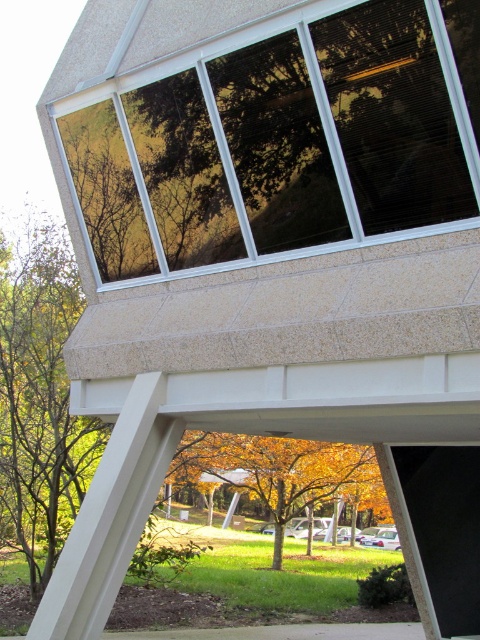
Does clear glass window at upper center have a greater height compared to golden leafy tree at center?

No, clear glass window at upper center is not taller than golden leafy tree at center.

This screenshot has height=640, width=480. What are the coordinates of `clear glass window at upper center` in the screenshot? It's located at (272, 140).

What are the coordinates of `clear glass window at upper center` in the screenshot? It's located at (272, 140).